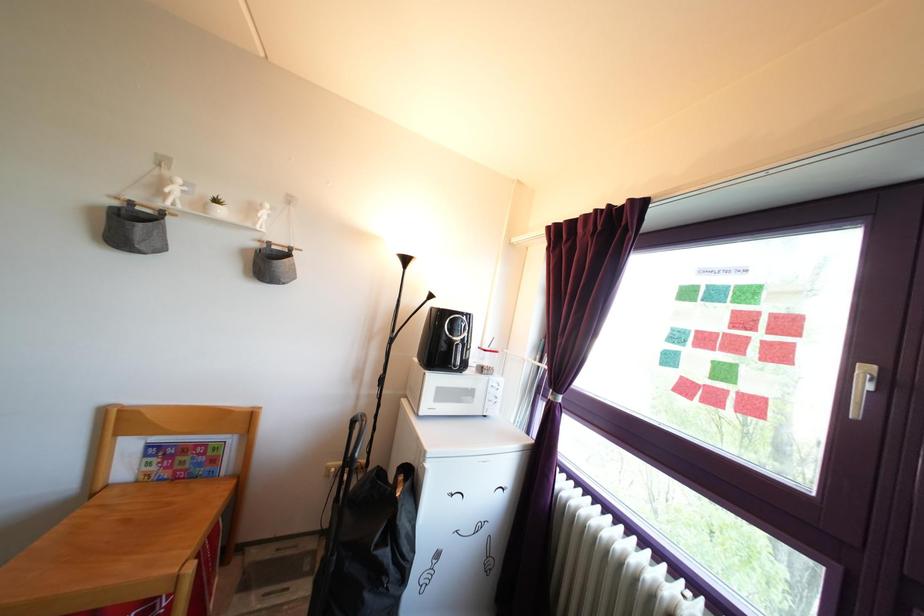
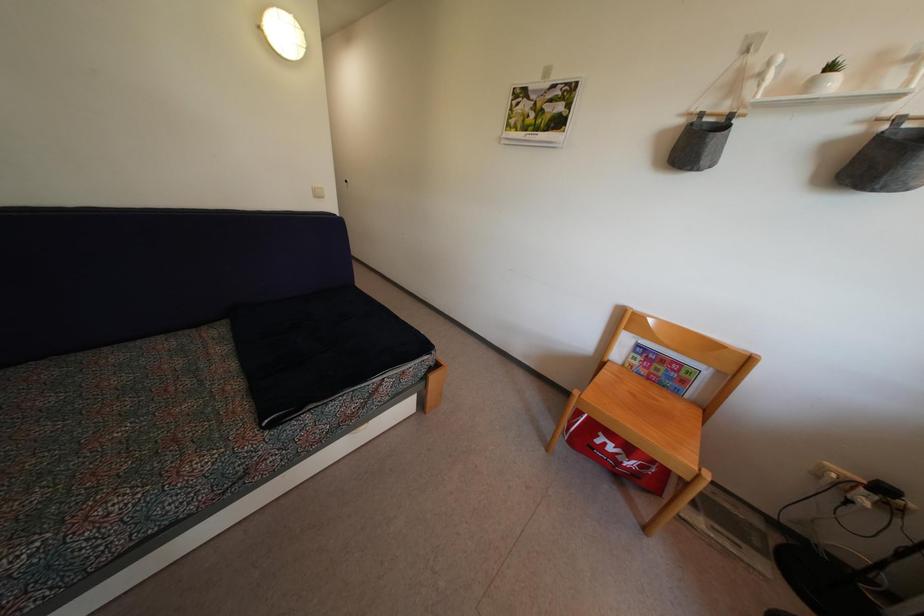
Where in the second image is the point corresponding to (118,211) from the first image?

(685, 129)